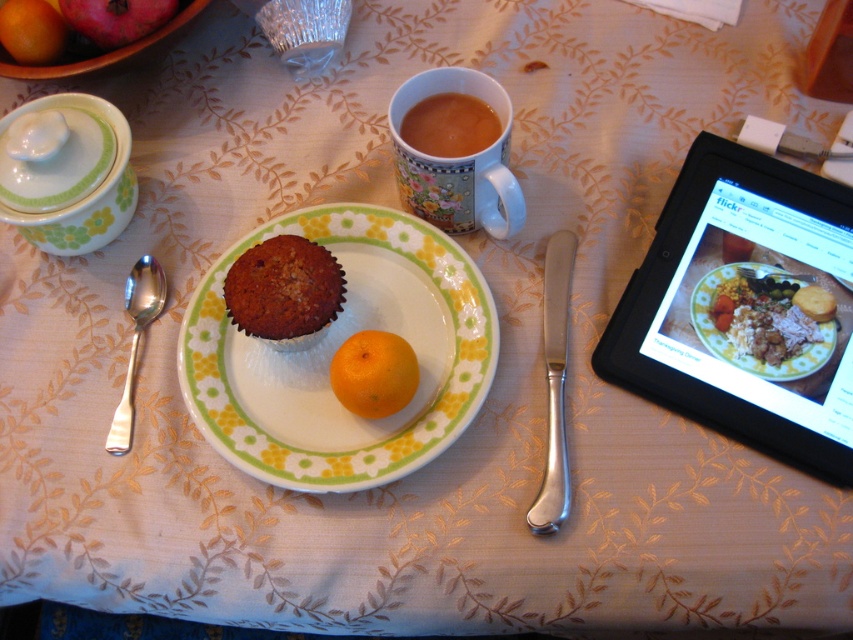
You are setting up a table for a guest and want to place a drink coaster between the black plastic tablet at upper right and the smooth red apple at upper left. Which object requires more space horizontally to accommodate the coaster?

The black plastic tablet at upper right requires more space horizontally because its width surpasses that of the smooth red apple at upper left.

You are a chef preparing a meal and need to know which item takes up more space on the table. Which one is larger in size between the smooth brown rice at upper right and the brown crumbly muffin at center?

The brown crumbly muffin at center takes up more space than the smooth brown rice at upper right.

You are setting up a fruit platter for a party and have the smooth red apple at upper left and the orange matte at upper left. Which fruit should you choose if you want the largest piece for presentation?

The smooth red apple at upper left has a larger size compared to the orange matte at upper left, so you should choose the smooth red apple at upper left for the largest piece in your presentation.